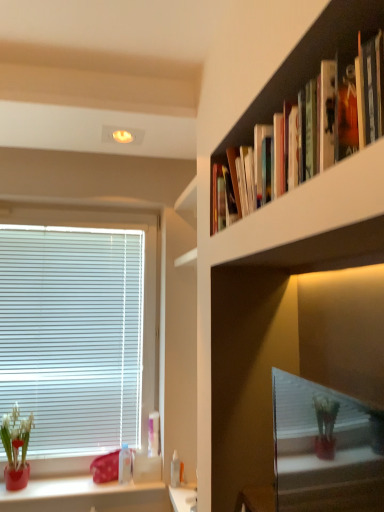
Question: From a real-world perspective, is transparent plastic bottle at lower left, which ranks as the third toiletry in right-to-left order, over white plastic bottle at lower center, placed as the third toiletry when sorted from left to right?

Choices:
 (A) yes
 (B) no

Answer: (A)

Question: Can you confirm if transparent plastic bottle at lower left, which ranks as the third toiletry in right-to-left order, is smaller than white plastic bottle at lower center, marked as the first toiletry in a right-to-left arrangement?

Choices:
 (A) no
 (B) yes

Answer: (A)

Question: Is transparent plastic bottle at lower left, arranged as the 1th toiletry when viewed from the left, completely or partially outside of white plastic bottle at lower center, placed as the third toiletry when sorted from left to right?

Choices:
 (A) yes
 (B) no

Answer: (A)

Question: From the image's perspective, would you say transparent plastic bottle at lower left, which ranks as the third toiletry in right-to-left order, is positioned over white plastic bottle at lower center, marked as the first toiletry in a right-to-left arrangement?

Choices:
 (A) no
 (B) yes

Answer: (B)

Question: Is transparent plastic bottle at lower left, which ranks as the third toiletry in right-to-left order, positioned before white plastic bottle at lower center, marked as the first toiletry in a right-to-left arrangement?

Choices:
 (A) no
 (B) yes

Answer: (B)

Question: Which is correct: white plastic bottle at lower center, marked as the first toiletry in a right-to-left arrangement, is inside matte red vase at lower left, or outside of it?

Choices:
 (A) outside
 (B) inside

Answer: (A)

Question: Considering their positions, is white plastic bottle at lower center, placed as the third toiletry when sorted from left to right, located in front of or behind matte red vase at lower left?

Choices:
 (A) behind
 (B) front

Answer: (A)

Question: Is white plastic bottle at lower center, placed as the third toiletry when sorted from left to right, taller or shorter than matte red vase at lower left?

Choices:
 (A) tall
 (B) short

Answer: (B)

Question: Is white plastic bottle at lower center, placed as the third toiletry when sorted from left to right, to the left or to the right of matte red vase at lower left in the image?

Choices:
 (A) right
 (B) left

Answer: (A)

Question: From a real-world perspective, is transparent plastic bottle at lower left, arranged as the 1th toiletry when viewed from the left, above or below transparent plastic bottle at lower center, positioned as the 2th toiletry in right-to-left order?

Choices:
 (A) above
 (B) below

Answer: (A)

Question: Is transparent plastic bottle at lower left, which ranks as the third toiletry in right-to-left order, wider or thinner than transparent plastic bottle at lower center, positioned as the 2th toiletry in right-to-left order?

Choices:
 (A) thin
 (B) wide

Answer: (B)

Question: In the image, is transparent plastic bottle at lower left, arranged as the 1th toiletry when viewed from the left, on the left side or the right side of transparent plastic bottle at lower center, which ranks as the 2th toiletry in left-to-right order?

Choices:
 (A) right
 (B) left

Answer: (B)

Question: In terms of height, does transparent plastic bottle at lower left, arranged as the 1th toiletry when viewed from the left, look taller or shorter compared to transparent plastic bottle at lower center, which ranks as the 2th toiletry in left-to-right order?

Choices:
 (A) short
 (B) tall

Answer: (B)

Question: Is white glossy vanity at lower center in front of or behind hardcover books at upper right in the image?

Choices:
 (A) behind
 (B) front

Answer: (A)

Question: Considering the positions of point (173, 500) and point (288, 66), is point (173, 500) closer or farther from the camera than point (288, 66)?

Choices:
 (A) closer
 (B) farther

Answer: (B)